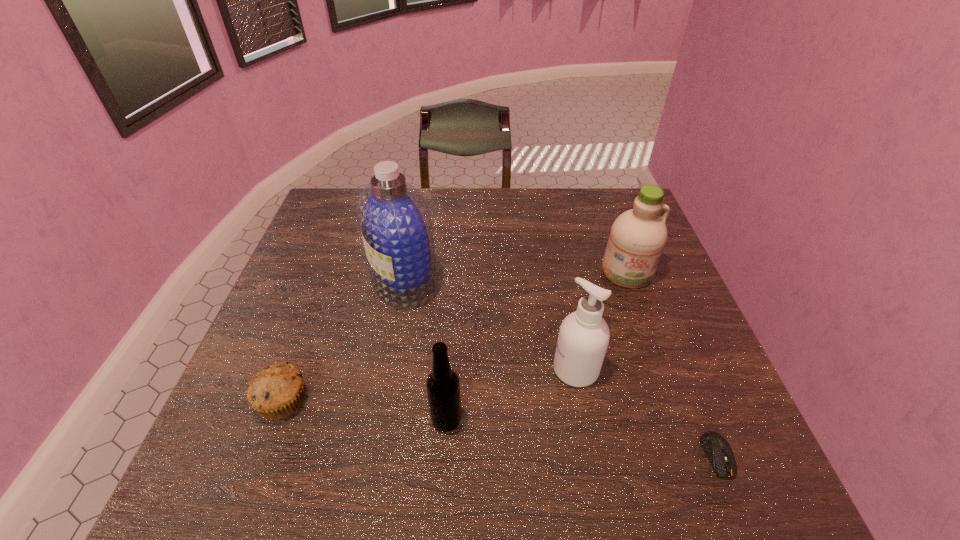
I want to click on free space between the second shortest object and the shortest object, so click(500, 428).

The width and height of the screenshot is (960, 540). In order to click on vacant space in between the nearest cleansing agent and the fourth object from right to left in this screenshot , I will do `click(511, 394)`.

At what (x,y) coordinates should I click in order to perform the action: click on free space between the rightmost cleansing agent and the third object from left to right. Please return your answer as a coordinate pair (x, y). The image size is (960, 540). Looking at the image, I should click on (537, 346).

Locate an element on the screen. empty location between the second cleansing agent from right to left and the tallest cleansing agent is located at coordinates (490, 326).

Select which object is the fourth closest to the rightmost cleansing agent. Please provide its 2D coordinates. Your answer should be formatted as a tuple, i.e. [(x, y)], where the tuple contains the x and y coordinates of a point satisfying the conditions above.

[(443, 387)]

Identify which object is the nearest to the shortest object. Please provide its 2D coordinates. Your answer should be formatted as a tuple, i.e. [(x, y)], where the tuple contains the x and y coordinates of a point satisfying the conditions above.

[(583, 338)]

Select which cleansing agent is the second closest to the tallest cleansing agent. Please provide its 2D coordinates. Your answer should be formatted as a tuple, i.e. [(x, y)], where the tuple contains the x and y coordinates of a point satisfying the conditions above.

[(638, 236)]

Where is `cleansing agent that is the closest to the second object from left to right`? The height and width of the screenshot is (540, 960). cleansing agent that is the closest to the second object from left to right is located at coordinates (583, 338).